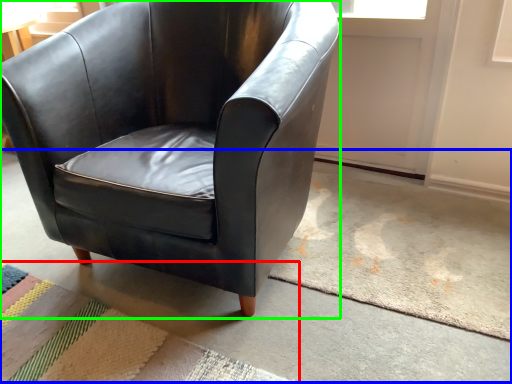
Question: Which object is positioned closest to mat (highlighted by a red box)? Select from concrete (highlighted by a blue box) and chair (highlighted by a green box).

Choices:
 (A) concrete
 (B) chair

Answer: (A)